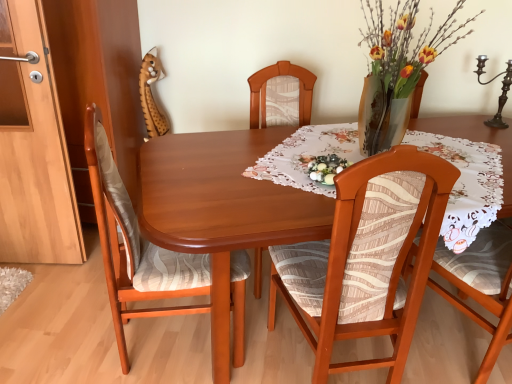
Question: Considering their positions, is wooden chair with patterned fabric at center, positioned as the 1th chair in right-to-left order, located in front of or behind floral lace tablecloth at center?

Choices:
 (A) front
 (B) behind

Answer: (A)

Question: Considering the positions of point (359, 243) and point (296, 165), is point (359, 243) closer or farther from the camera than point (296, 165)?

Choices:
 (A) closer
 (B) farther

Answer: (A)

Question: Estimate the real-world distances between objects in this image. Which object is closer to the polished dark brown candle holder at upper right?

Choices:
 (A) wooden chair with patterned fabric at center, positioned as the 1th chair in right-to-left order
 (B) floral lace tablecloth at center
 (C) wooden chair at left, arranged as the first chair when viewed from the left
 (D) matte wood cabinet at left
 (E) mahogany wood table at center

Answer: (B)

Question: Which of these objects is positioned farthest from the wooden chair at left, which is the second chair in right-to-left order?

Choices:
 (A) polished dark brown candle holder at upper right
 (B) floral lace tablecloth at center
 (C) matte wood cabinet at left
 (D) wooden chair with patterned fabric at center, which is counted as the second chair, starting from the left
 (E) mahogany wood table at center

Answer: (A)